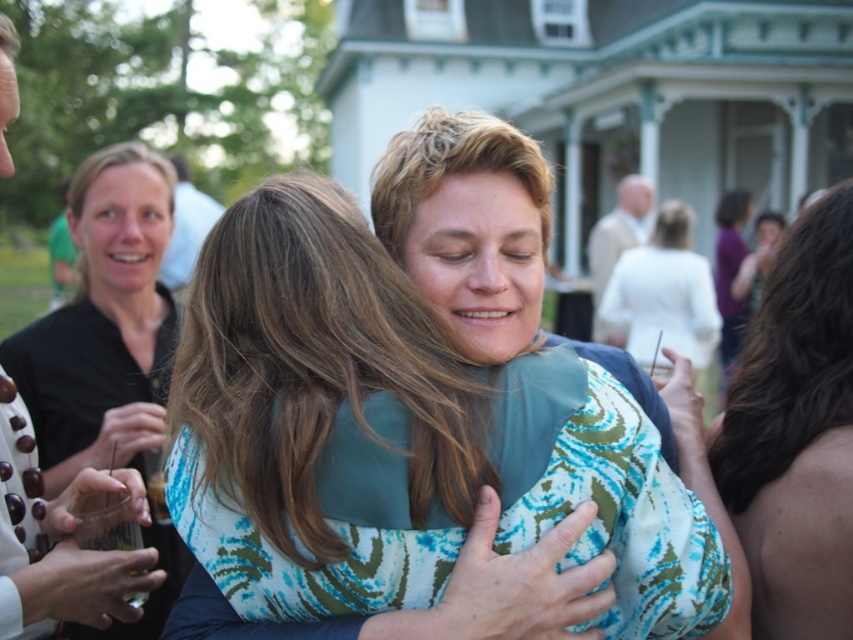
Question: Does dark brown hair at right appear on the left side of black matte shirt at upper left?

Choices:
 (A) no
 (B) yes

Answer: (A)

Question: Which of the following is the farthest from the observer?

Choices:
 (A) white satin dress at center
 (B) printed fabric dress at center

Answer: (A)

Question: Estimate the real-world distances between objects in this image. Which object is closer to the printed fabric dress at center?

Choices:
 (A) dark brown hair at right
 (B) white satin dress at center

Answer: (A)

Question: Can you confirm if white satin dress at center is positioned above matte white shirt at upper left?

Choices:
 (A) no
 (B) yes

Answer: (A)

Question: Considering the real-world distances, which object is farthest from the dark brown hair at right?

Choices:
 (A) matte white shirt at upper left
 (B) printed fabric dress at center

Answer: (A)

Question: Can you confirm if printed fabric dress at center is bigger than black matte shirt at upper left?

Choices:
 (A) no
 (B) yes

Answer: (A)